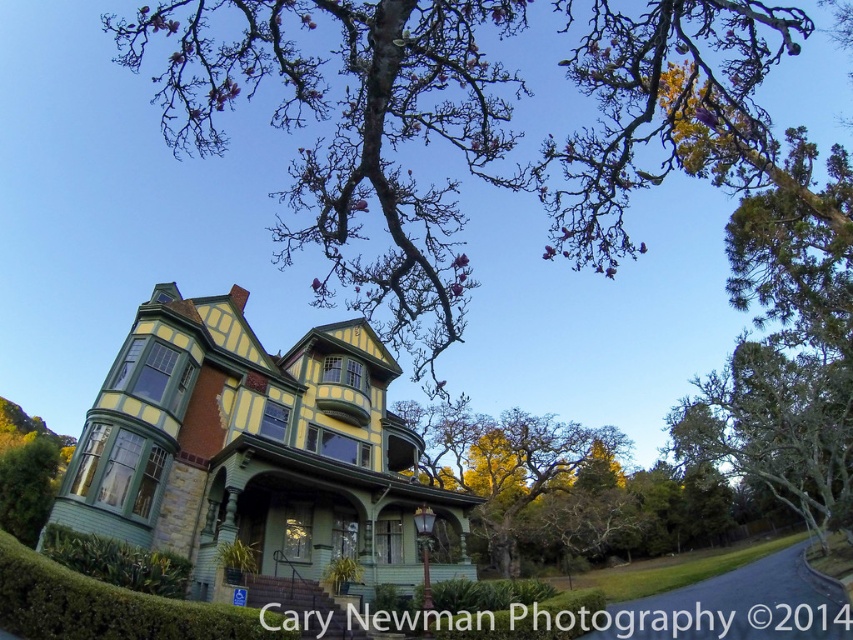
Between point (761, 72) and point (770, 435), which one is positioned in front?

Point (761, 72) is more forward.

Does bare branches at upper center come in front of green leafy tree at right?

That is True.

Between point (679, 106) and point (759, 429), which one is positioned in front?

Point (679, 106) is in front.

This screenshot has width=853, height=640. In order to click on bare branches at upper center in this screenshot , I will do `click(463, 124)`.

Can you confirm if bare branches at upper center is positioned below green leafy tree at center?

Incorrect, bare branches at upper center is not positioned below green leafy tree at center.

This screenshot has height=640, width=853. Identify the location of bare branches at upper center. (463, 124).

I want to click on bare branches at upper center, so click(463, 124).

Who is lower down, green leafy tree at right or green leafy tree at center?

green leafy tree at center is below.

Can you confirm if green leafy tree at right is thinner than green leafy tree at center?

Indeed, green leafy tree at right has a lesser width compared to green leafy tree at center.

Locate an element on the screen. The image size is (853, 640). green leafy tree at right is located at coordinates (776, 428).

I want to click on green leafy tree at right, so click(776, 428).